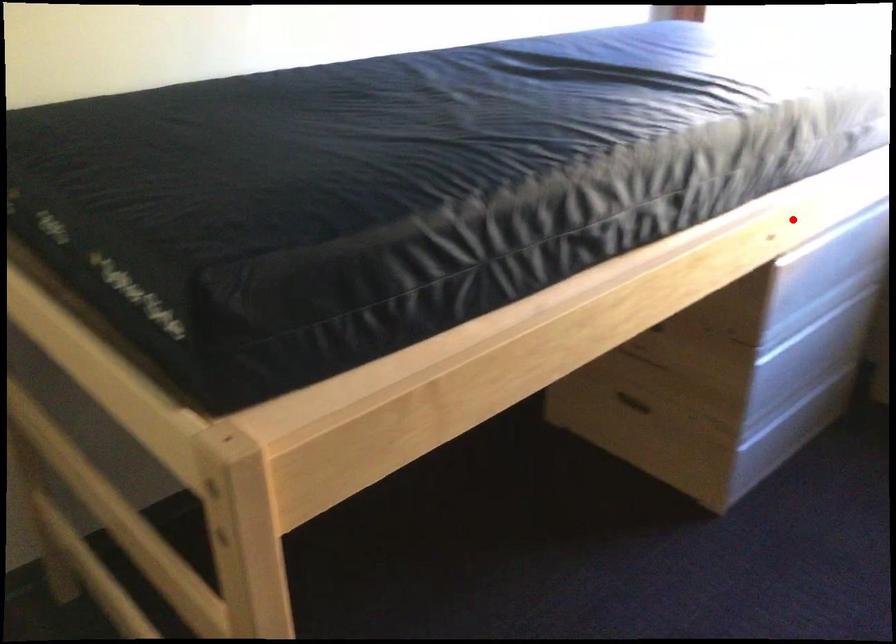
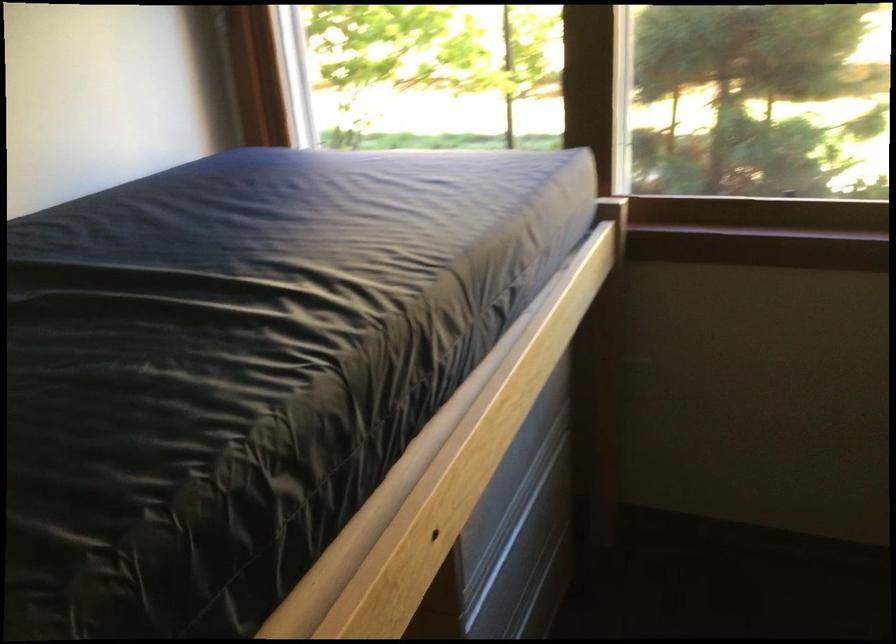
Question: A red point is marked in image1. In image2, is the corresponding 3D point closer to the camera or farther? Reply with the corresponding letter.

Choices:
 (A) The corresponding 3D point is closer.
 (B) The corresponding 3D point is farther.

Answer: (A)